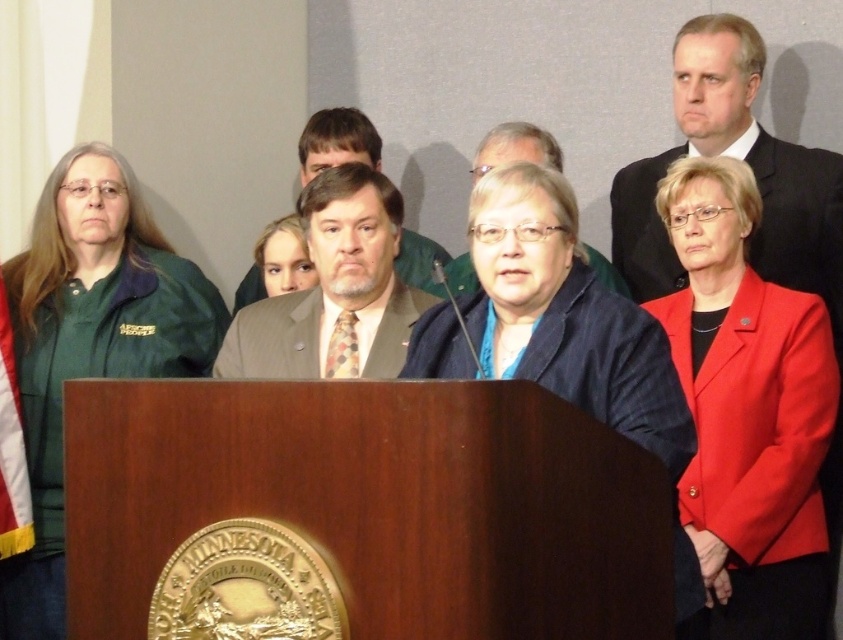
You are standing in front of the Minnesota state seal podium and want to place a small decoration between the two points, point (811,595) and point (776,205). Which point is closer to you so you can place the decoration there?

Point (811,595) is closer to the viewer than point (776,205), so you should place the decoration near point (811,595).

You are a photographer at the event and need to capture a group photo of the green fabric jacket at left and the dark suit at upper right. The camera has a minimum focus distance of 6 feet. Will you be able to focus on both subjects clearly?

The green fabric jacket at left and dark suit at upper right are 6.83 feet apart, so yes, the camera can focus on both subjects clearly since the distance between them is greater than the minimum focus distance of 6 feet.